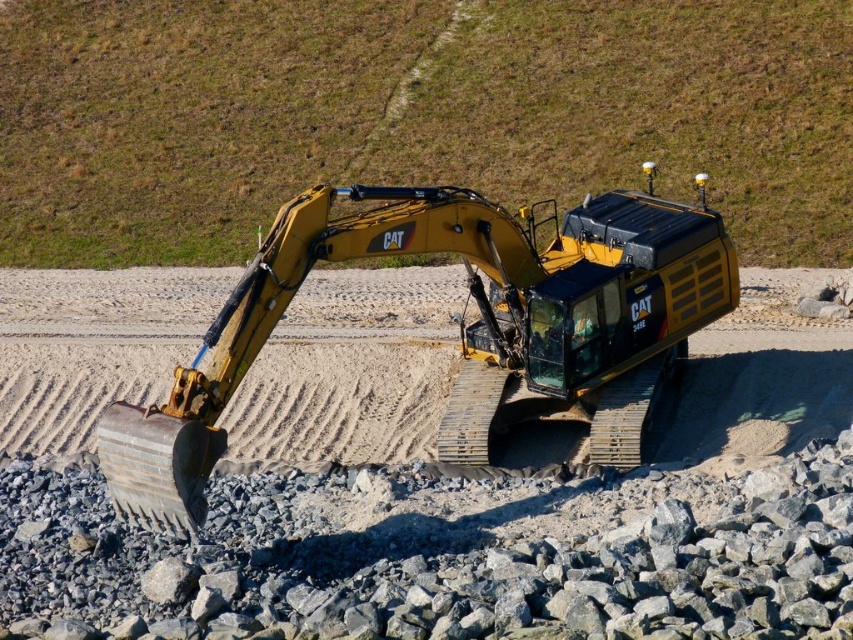
You are a construction worker standing at the edge of the construction site. You need to walk from the gray gravel at lower center to the yellow metallic tractor at center. Which direction should you move to reach the tractor?

The gray gravel at lower center is to the left of the yellow metallic tractor at center, so you should move to the right to reach the tractor.